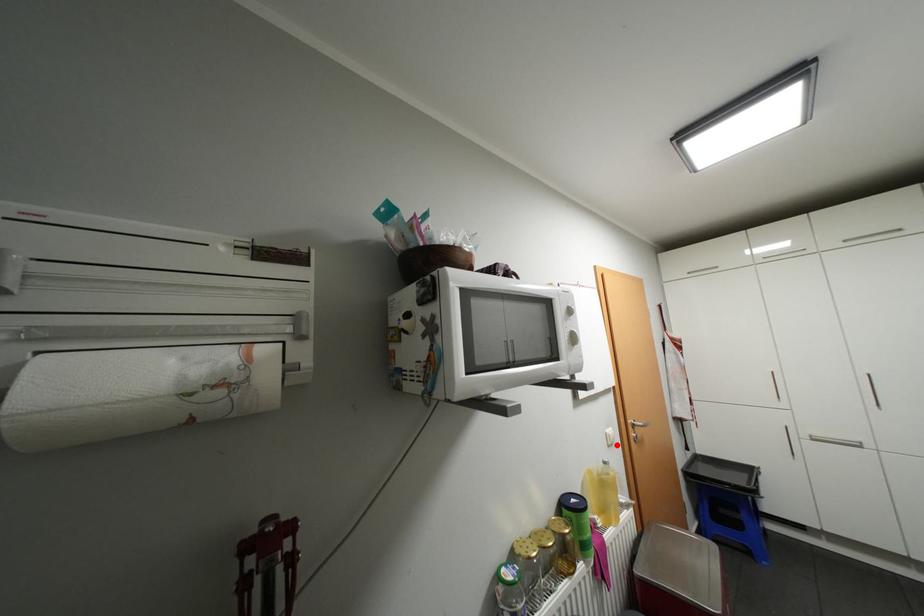
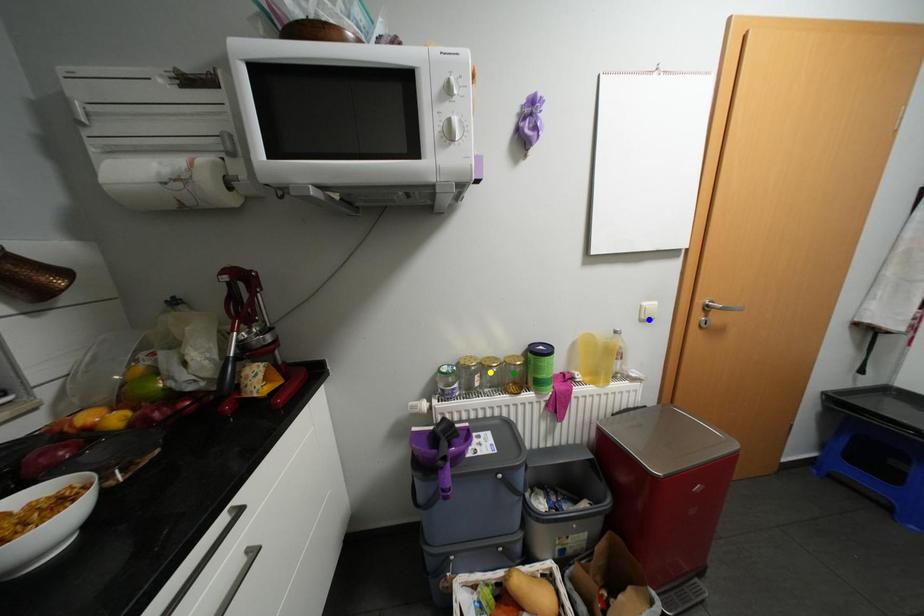
Question: I am providing you with two images of the same scene from different viewpoints. A red point is marked on the first image. You are given multiple points on the second image. Which spot in image 2 lines up with the point in image 1?

Choices:
 (A) blue point
 (B) yellow point
 (C) green point

Answer: (A)